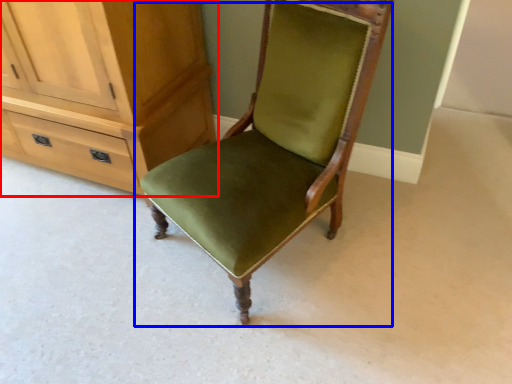
Question: Which point is further to the camera, cabinetry (highlighted by a red box) or chair (highlighted by a blue box)?

Choices:
 (A) cabinetry
 (B) chair

Answer: (A)